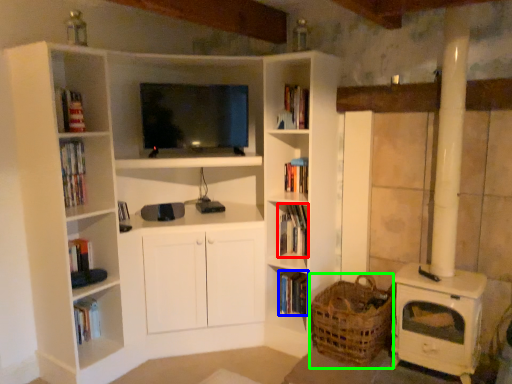
Question: Estimate the real-world distances between objects in this image. Which object is farther from book (highlighted by a red box), book (highlighted by a blue box) or basket (highlighted by a green box)?

Choices:
 (A) book
 (B) basket

Answer: (B)